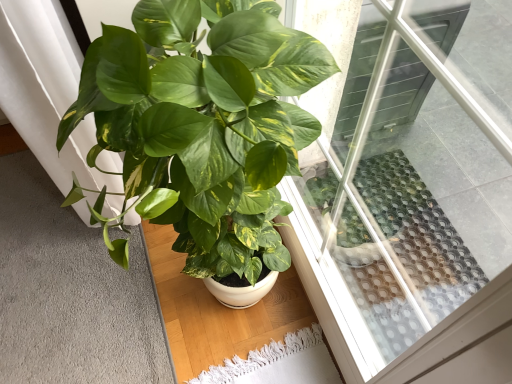
This screenshot has width=512, height=384. What do you see at coordinates (408, 187) in the screenshot?
I see `transparent glass window at upper center` at bounding box center [408, 187].

Where is `green glossy leafy plant at center`? This screenshot has height=384, width=512. green glossy leafy plant at center is located at coordinates (205, 122).

Is point (405, 204) positioned in front of point (209, 0)?

That is False.

There is a green glossy leafy plant at center. Where is `window above it (from a real-world perspective)`? window above it (from a real-world perspective) is located at coordinates (408, 187).

Which of these two, transparent glass window at upper center or green glossy leafy plant at center, is thinner?

With smaller width is transparent glass window at upper center.

Considering the relative sizes of transparent glass window at upper center and green glossy leafy plant at center in the image provided, is transparent glass window at upper center shorter than green glossy leafy plant at center?

Incorrect, the height of transparent glass window at upper center does not fall short of that of green glossy leafy plant at center.

Can we say transparent glass window at upper center lies outside soft gray carpet at lower left?

Indeed, transparent glass window at upper center is completely outside soft gray carpet at lower left.

Considering the relative positions of transparent glass window at upper center and soft gray carpet at lower left in the image provided, is transparent glass window at upper center to the left of soft gray carpet at lower left from the viewer's perspective?

No.

From the image's perspective, is transparent glass window at upper center located beneath soft gray carpet at lower left?

No, from the image's perspective, transparent glass window at upper center is not beneath soft gray carpet at lower left.

Could you tell me if transparent glass window at upper center is facing soft gray carpet at lower left?

Yes, transparent glass window at upper center is turned towards soft gray carpet at lower left.

Relative to transparent glass window at upper center, is green glossy leafy plant at center in front or behind?

green glossy leafy plant at center is positioned farther from the viewer than transparent glass window at upper center.

Considering the relative sizes of green glossy leafy plant at center and transparent glass window at upper center in the image provided, is green glossy leafy plant at center wider than transparent glass window at upper center?

Yes.

How distant is soft gray carpet at lower left from green glossy leafy plant at center?

soft gray carpet at lower left is 73.51 centimeters away from green glossy leafy plant at center.

How many degrees apart are the facing directions of soft gray carpet at lower left and green glossy leafy plant at center?

There is a 0.63-degree angle between the facing directions of soft gray carpet at lower left and green glossy leafy plant at center.

Where is `gray below the green glossy leafy plant at center (from the image's perspective)`? gray below the green glossy leafy plant at center (from the image's perspective) is located at coordinates (70, 293).

Considering the relative sizes of soft gray carpet at lower left and green glossy leafy plant at center in the image provided, is soft gray carpet at lower left bigger than green glossy leafy plant at center?

No, soft gray carpet at lower left is not bigger than green glossy leafy plant at center.

From the image's perspective, which object appears higher, green glossy leafy plant at center or soft gray carpet at lower left?

green glossy leafy plant at center.

Which of these two, green glossy leafy plant at center or soft gray carpet at lower left, is thinner?

soft gray carpet at lower left is thinner.

Locate an element on the screen. Image resolution: width=512 pixels, height=384 pixels. houseplant that is on the right side of soft gray carpet at lower left is located at coordinates (205, 122).

Which object is closer to the camera taking this photo, green glossy leafy plant at center or soft gray carpet at lower left?

Positioned in front is green glossy leafy plant at center.

From a real-world perspective, is soft gray carpet at lower left below transparent glass window at upper center?

Indeed, from a real-world perspective, soft gray carpet at lower left is positioned beneath transparent glass window at upper center.

Looking at this image, considering the relative positions of soft gray carpet at lower left and transparent glass window at upper center in the image provided, is soft gray carpet at lower left behind transparent glass window at upper center?

Yes, soft gray carpet at lower left is behind transparent glass window at upper center.

Considering the sizes of objects soft gray carpet at lower left and transparent glass window at upper center in the image provided, who is shorter, soft gray carpet at lower left or transparent glass window at upper center?

soft gray carpet at lower left is shorter.

From the picture: Can you see soft gray carpet at lower left touching transparent glass window at upper center?

No, soft gray carpet at lower left is not in contact with transparent glass window at upper center.

Locate an element on the screen. houseplant below the transparent glass window at upper center (from the image's perspective) is located at coordinates tap(205, 122).

Locate an element on the screen. gray below the transparent glass window at upper center (from a real-world perspective) is located at coordinates (70, 293).

Estimate the real-world distances between objects in this image. Which object is closer to soft gray carpet at lower left, green glossy leafy plant at center or transparent glass window at upper center?

green glossy leafy plant at center is positioned closer to the anchor soft gray carpet at lower left.

Estimate the real-world distances between objects in this image. Which object is closer to transparent glass window at upper center, soft gray carpet at lower left or green glossy leafy plant at center?

green glossy leafy plant at center is closer to transparent glass window at upper center.

Which object lies nearer to the anchor point green glossy leafy plant at center, transparent glass window at upper center or soft gray carpet at lower left?

The object closer to green glossy leafy plant at center is transparent glass window at upper center.

Based on the photo, based on their spatial positions, is green glossy leafy plant at center or soft gray carpet at lower left further from transparent glass window at upper center?

soft gray carpet at lower left.

Looking at the image, which one is located closer to soft gray carpet at lower left, transparent glass window at upper center or green glossy leafy plant at center?

The object closer to soft gray carpet at lower left is green glossy leafy plant at center.

Estimate the real-world distances between objects in this image. Which object is further from green glossy leafy plant at center, soft gray carpet at lower left or transparent glass window at upper center?

soft gray carpet at lower left.

Where is `houseplant between transparent glass window at upper center and soft gray carpet at lower left along the z-axis`? This screenshot has height=384, width=512. houseplant between transparent glass window at upper center and soft gray carpet at lower left along the z-axis is located at coordinates (205, 122).